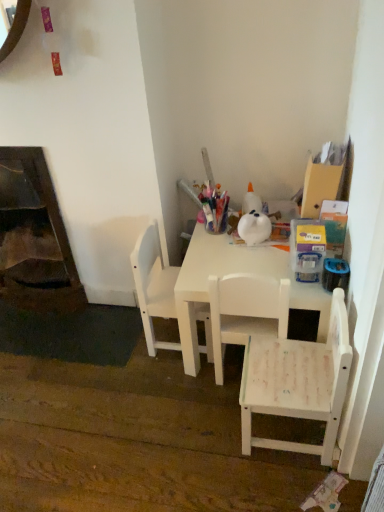
Where is `vacant space that is to the left of white matte chair at center, the 2th chair when ordered from left to right`? vacant space that is to the left of white matte chair at center, the 2th chair when ordered from left to right is located at coordinates (178, 389).